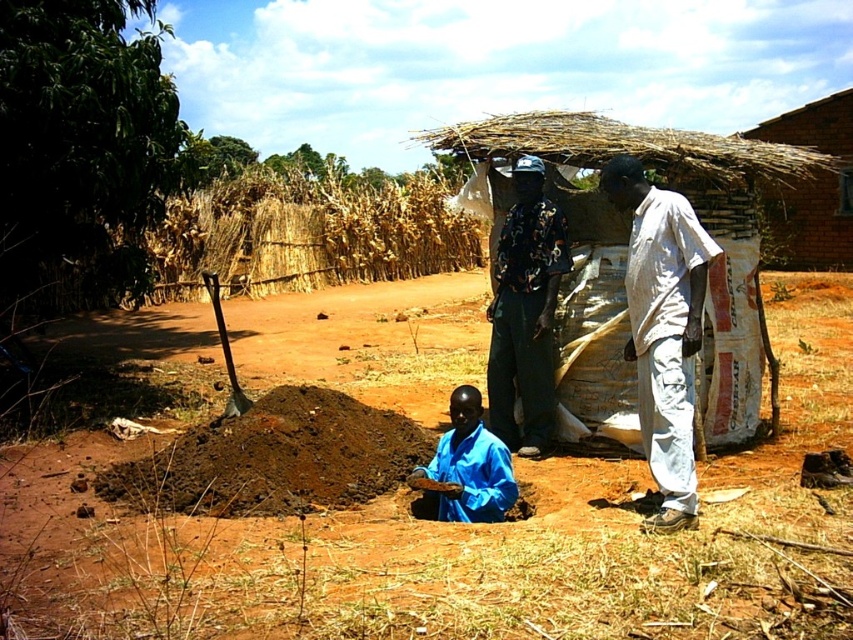
Question: Can you confirm if brown soil at center is positioned to the right of dry straw at upper center?

Choices:
 (A) no
 (B) yes

Answer: (B)

Question: Which object appears closest to the camera in this image?

Choices:
 (A) blue fabric shirt at lower center
 (B) brown soil at center
 (C) light gray cotton shirt at right

Answer: (B)

Question: Which of the following is the closest to the observer?

Choices:
 (A) (498, 500)
 (B) (99, 531)
 (C) (662, 481)

Answer: (C)

Question: Which of the following is the closest to the observer?

Choices:
 (A) (262, 188)
 (B) (526, 252)
 (C) (490, 486)

Answer: (C)

Question: Can you confirm if light gray cotton shirt at right is positioned to the right of black printed shirt at center?

Choices:
 (A) yes
 (B) no

Answer: (A)

Question: Can you confirm if dry straw at upper center is thinner than blue fabric shirt at lower center?

Choices:
 (A) yes
 (B) no

Answer: (B)